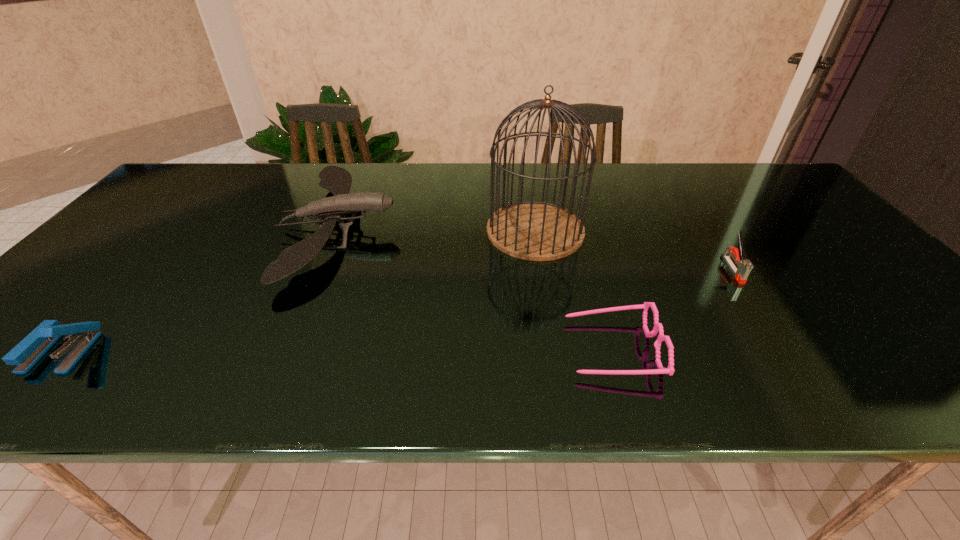
This screenshot has width=960, height=540. What are the coordinates of `birdcage` in the screenshot? It's located at (539, 231).

Identify the location of the second object from left to right. (337, 180).

Find the location of a particular element. the rightmost object is located at coordinates (745, 266).

The width and height of the screenshot is (960, 540). I want to click on the right stapler, so click(745, 266).

Locate an element on the screen. the left stapler is located at coordinates (30, 350).

Find the location of a particular element. This screenshot has height=540, width=960. the leftmost object is located at coordinates (30, 350).

The image size is (960, 540). In order to click on spectacles in this screenshot , I will do `click(658, 327)`.

The image size is (960, 540). Find the location of `vacant space located at the door of the birdcage`. vacant space located at the door of the birdcage is located at coordinates (407, 231).

Find the location of a particular element. The height and width of the screenshot is (540, 960). vacant space situated 0.380m at the door of the birdcage is located at coordinates (349, 231).

The width and height of the screenshot is (960, 540). I want to click on vacant position located at the door of the birdcage, so click(440, 231).